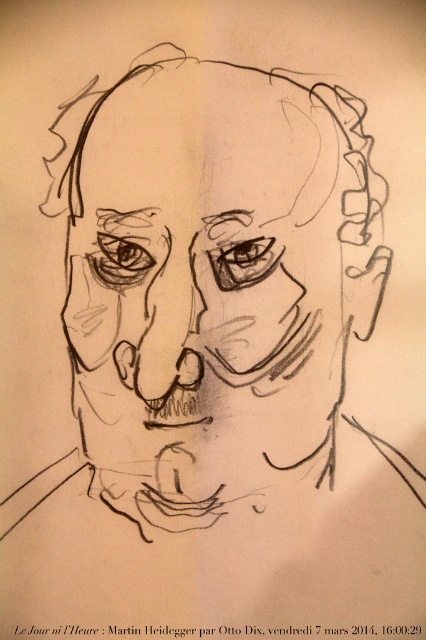
Is graphite sketch of head at center positioned behind matte black nose at center?

No, graphite sketch of head at center is in front of matte black nose at center.

How much distance is there between graphite sketch of head at center and matte black nose at center?

A distance of 4.11 inches exists between graphite sketch of head at center and matte black nose at center.

The height and width of the screenshot is (640, 426). What are the coordinates of `graphite sketch of head at center` in the screenshot? It's located at (213, 264).